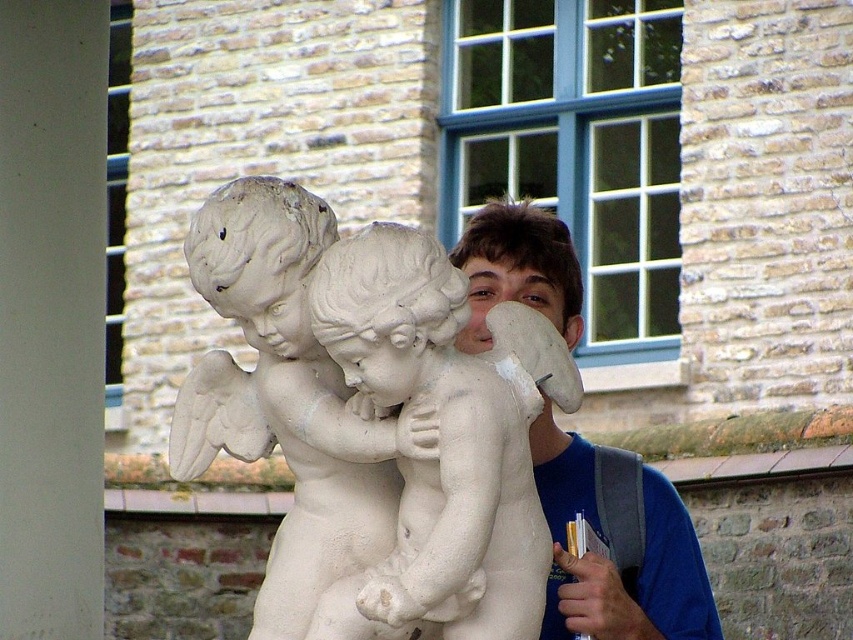
What object is located at the coordinates point (285, 397) in the image?

The point (285, 397) corresponds to the white stone cherubs at center.

You are a photographer trying to capture a clear shot of the blue matte shirt at center and the white stone cherubs at center. Based on their positions, which object should you focus on first to ensure both are in frame?

The white stone cherubs at center is positioned on the left side of blue matte shirt at center, so you should focus on the white stone cherubs at center first to ensure both are in frame.

You are an artist trying to sketch the scene. You notice the white stone cherubs at center and the blue matte shirt at center. Which object should you draw first if you want to focus on the wider one?

The white stone cherubs at center should be drawn first because their width is larger than the blue matte shirt at center.